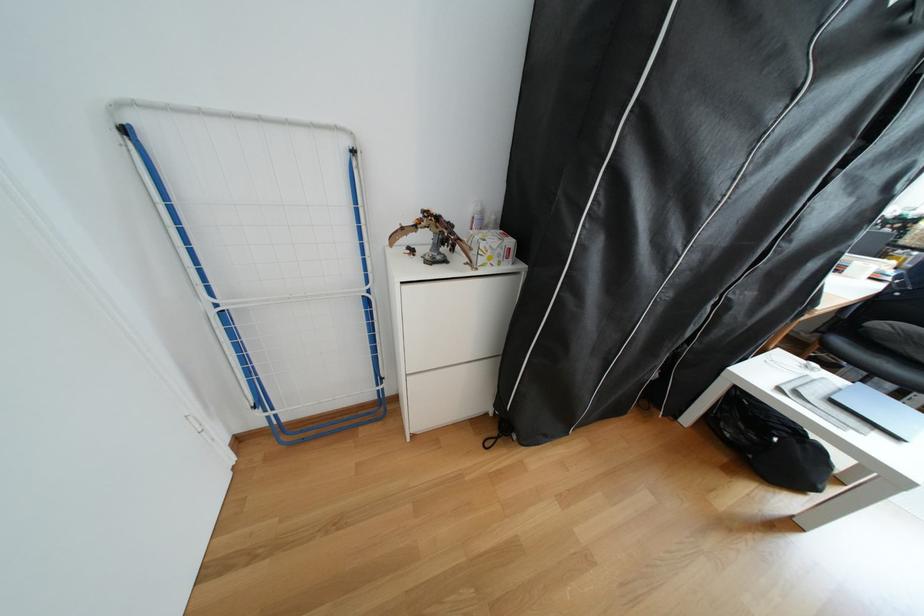
This screenshot has height=616, width=924. In order to click on chair sitting surface in this screenshot , I will do `click(892, 336)`.